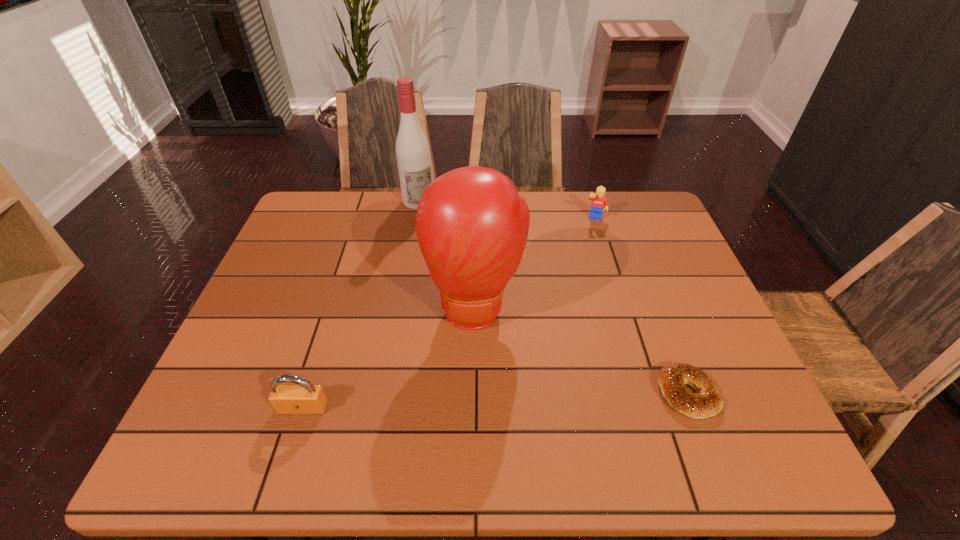
This screenshot has height=540, width=960. I want to click on bagel present at the near edge, so click(672, 378).

This screenshot has width=960, height=540. Identify the location of object that is at the left edge. (303, 398).

Locate an element on the screen. object that is at the right edge is located at coordinates (672, 378).

Identify the location of object located at the near left corner. (303, 398).

Where is `object present at the near right corner`? object present at the near right corner is located at coordinates (672, 378).

The height and width of the screenshot is (540, 960). I want to click on vacant space at the far edge of the desktop, so click(x=565, y=226).

In the image, there is a desktop. Where is `vacant region at the near edge`? vacant region at the near edge is located at coordinates (647, 381).

Image resolution: width=960 pixels, height=540 pixels. In the image, there is a desktop. What are the coordinates of `vacant space at the left edge` in the screenshot? It's located at (323, 252).

In order to click on vacant space at the right edge in this screenshot , I will do `click(725, 374)`.

Identify the location of vacant region at the far left corner of the desktop. (344, 209).